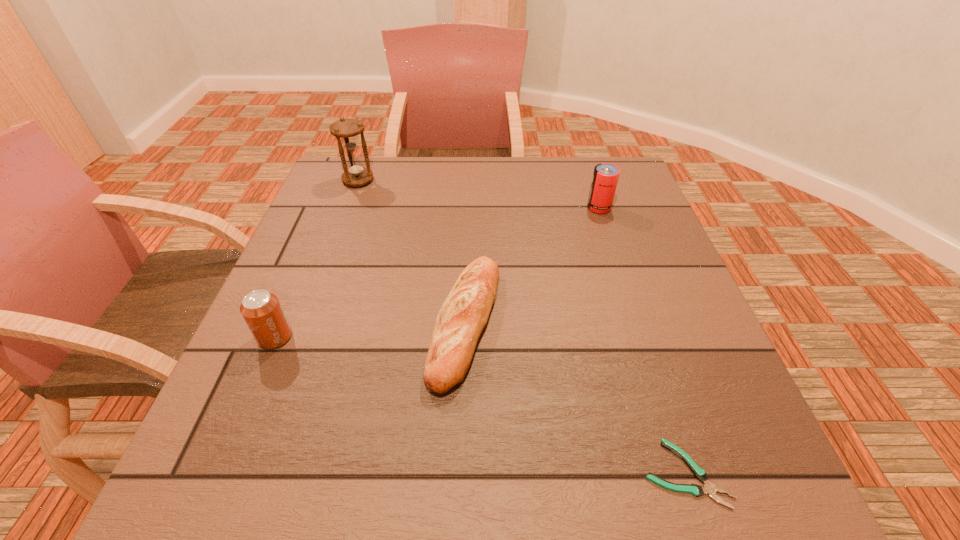
At what (x,y) coordinates should I click in order to perform the action: click on hourglass. Please return your answer as a coordinate pair (x, y). The width and height of the screenshot is (960, 540). Looking at the image, I should click on (346, 131).

Identify the location of the farthest object. (346, 131).

What are the coordinates of `the fourth nearest object` in the screenshot? It's located at point(605,177).

Image resolution: width=960 pixels, height=540 pixels. I want to click on the right can, so click(x=605, y=177).

Identify the location of the nearer can. (261, 310).

You are a GUI agent. You are given a task and a screenshot of the screen. Output one action in this format:
    pyautogui.click(x=<x>, y=<y>)
    Task: Click on the second shortest object
    The width and height of the screenshot is (960, 540).
    Given the screenshot: What is the action you would take?
    pyautogui.click(x=464, y=314)

Find the location of a particular element. The width and height of the screenshot is (960, 540). the third object from left to right is located at coordinates (464, 314).

Image resolution: width=960 pixels, height=540 pixels. I want to click on the nearest object, so click(708, 488).

In order to click on the shortest object in this screenshot , I will do `click(708, 488)`.

I want to click on vacant area situated on the right of the tallest object, so click(419, 180).